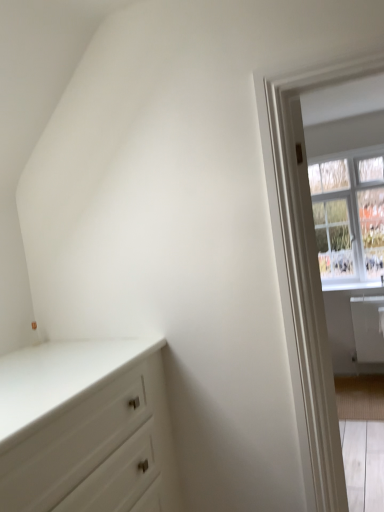
Question: Considering the relative sizes of white glossy window sill at right and clear glass window at upper right in the image provided, is white glossy window sill at right smaller than clear glass window at upper right?

Choices:
 (A) no
 (B) yes

Answer: (B)

Question: Considering the relative sizes of white glossy window sill at right and clear glass window at upper right in the image provided, is white glossy window sill at right taller than clear glass window at upper right?

Choices:
 (A) yes
 (B) no

Answer: (B)

Question: Considering the relative sizes of white glossy window sill at right and clear glass window at upper right in the image provided, is white glossy window sill at right wider than clear glass window at upper right?

Choices:
 (A) no
 (B) yes

Answer: (A)

Question: From a real-world perspective, is white glossy window sill at right beneath clear glass window at upper right?

Choices:
 (A) yes
 (B) no

Answer: (A)

Question: Is white glossy window sill at right bigger than clear glass window at upper right?

Choices:
 (A) no
 (B) yes

Answer: (A)

Question: Could you tell me if white glossy window sill at right is turned towards clear glass window at upper right?

Choices:
 (A) no
 (B) yes

Answer: (B)

Question: Is white glossy chest of drawers at lower left directly adjacent to white wooden door at right?

Choices:
 (A) no
 (B) yes

Answer: (A)

Question: Would you say white glossy chest of drawers at lower left is a long distance from white wooden door at right?

Choices:
 (A) no
 (B) yes

Answer: (A)

Question: Considering the relative sizes of white glossy chest of drawers at lower left and white wooden door at right in the image provided, is white glossy chest of drawers at lower left wider than white wooden door at right?

Choices:
 (A) no
 (B) yes

Answer: (B)

Question: Is white glossy chest of drawers at lower left looking in the opposite direction of white wooden door at right?

Choices:
 (A) yes
 (B) no

Answer: (B)

Question: Is the depth of white glossy chest of drawers at lower left less than that of white wooden door at right?

Choices:
 (A) no
 (B) yes

Answer: (B)

Question: Considering the relative sizes of white glossy chest of drawers at lower left and white wooden door at right in the image provided, is white glossy chest of drawers at lower left thinner than white wooden door at right?

Choices:
 (A) no
 (B) yes

Answer: (A)

Question: From the image's perspective, is white wooden door at right on white glossy chest of drawers at lower left?

Choices:
 (A) yes
 (B) no

Answer: (A)